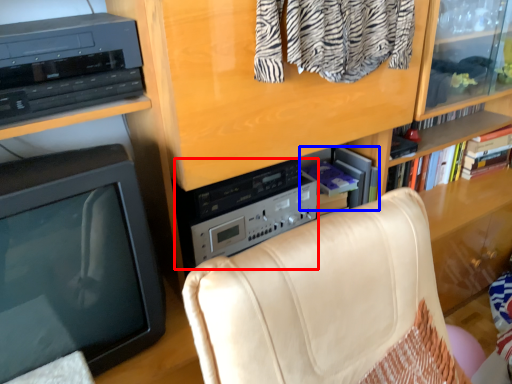
Question: Which object appears farthest to the camera in this image, amplifier (highlighted by a red box) or book (highlighted by a blue box)?

Choices:
 (A) amplifier
 (B) book

Answer: (B)